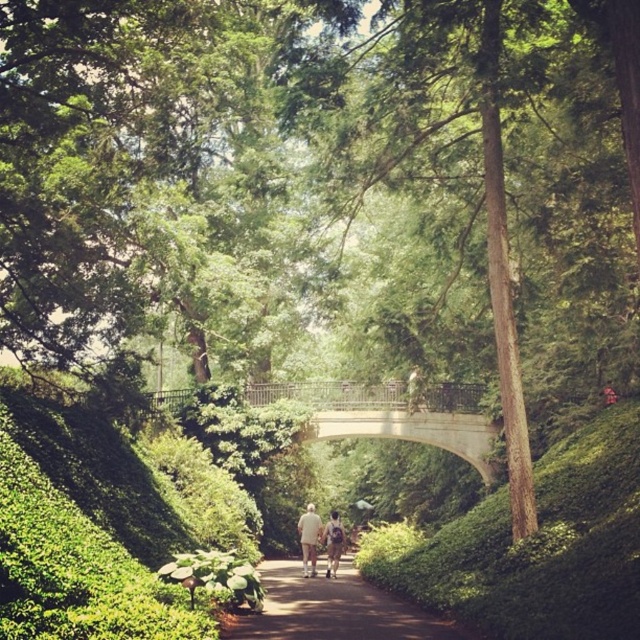
You are a gardener with a wheelbarrow that is 1.2 meters wide. You want to transport gardening tools along the brown dirt path at center. Can your wheelbarrow fit along the path without hitting the light beige fabric couple at center?

The brown dirt path at center might be wider than the light beige fabric couple at center, so the wheelbarrow could potentially fit, but there is uncertainty due to the comparative width not being explicitly stated.